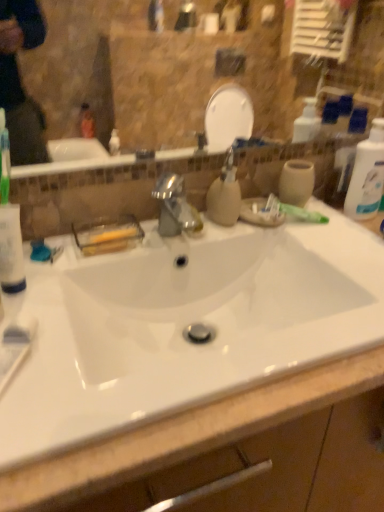
Find the location of a particular element. This screenshot has width=384, height=512. green matte toothpaste at upper right is located at coordinates (291, 211).

Where is `green matte toothpaste at upper right`? green matte toothpaste at upper right is located at coordinates (291, 211).

Between green matte toothpaste at upper right and white plastic bottle at right, which one has larger size?

white plastic bottle at right.

Can you confirm if green matte toothpaste at upper right is shorter than white plastic bottle at right?

Indeed, green matte toothpaste at upper right has a lesser height compared to white plastic bottle at right.

Can you tell me how much green matte toothpaste at upper right and white plastic bottle at right differ in facing direction?

37.6 degrees.

Does green matte toothpaste at upper right come in front of white plastic bottle at right?

No, it is behind white plastic bottle at right.

Which object is thinner, white plastic bottle at right or matte beige soap dispenser at center?

Thinner between the two is white plastic bottle at right.

Is white plastic bottle at right taller or shorter than matte beige soap dispenser at center?

Considering their sizes, white plastic bottle at right has more height than matte beige soap dispenser at center.

Looking at this image, from a real-world perspective, is white plastic bottle at right located higher than matte beige soap dispenser at center?

Indeed, from a real-world perspective, white plastic bottle at right stands above matte beige soap dispenser at center.

From the image's perspective, does white plastic bottle at right appear lower than matte beige soap dispenser at center?

Incorrect, from the image's perspective, white plastic bottle at right is higher than matte beige soap dispenser at center.

From the picture: Are white plastic bottle at right and white glossy sink at center making contact?

There is a gap between white plastic bottle at right and white glossy sink at center.

Find the location of a particular element. sink that is below the white plastic bottle at right (from the image's perspective) is located at coordinates (183, 324).

Which point is more distant from viewer, (356,197) or (303,255)?

The point (356,197) is farther from the camera.

From the image's perspective, which one is positioned lower, white plastic bottle at right or white glossy sink at center?

white glossy sink at center, from the image's perspective.

From the image's perspective, relative to matte beige soap dispenser at center, is green matte toothpaste at upper right above or below?

From the image's perspective, green matte toothpaste at upper right appears below matte beige soap dispenser at center.

Is green matte toothpaste at upper right looking in the opposite direction of matte beige soap dispenser at center?

No, green matte toothpaste at upper right's orientation is not away from matte beige soap dispenser at center.

Is green matte toothpaste at upper right positioned beyond the bounds of matte beige soap dispenser at center?

That's correct, green matte toothpaste at upper right is outside of matte beige soap dispenser at center.

Is green matte toothpaste at upper right further to the viewer compared to matte beige soap dispenser at center?

Yes, it is.

Considering the sizes of objects green matte toothpaste at upper right and white glossy sink at center in the image provided, who is thinner, green matte toothpaste at upper right or white glossy sink at center?

With smaller width is green matte toothpaste at upper right.

Can you confirm if green matte toothpaste at upper right is taller than white glossy sink at center?

Incorrect, the height of green matte toothpaste at upper right is not larger of that of white glossy sink at center.

Is green matte toothpaste at upper right positioned with its back to white glossy sink at center?

No, green matte toothpaste at upper right is not facing the opposite direction of white glossy sink at center.

From the image's perspective, relative to white glossy sink at center, is green matte toothpaste at upper right above or below?

green matte toothpaste at upper right is situated higher than white glossy sink at center in the image.

Considering the sizes of objects matte beige soap dispenser at center and green matte toothpaste at upper right in the image provided, who is shorter, matte beige soap dispenser at center or green matte toothpaste at upper right?

With less height is green matte toothpaste at upper right.

From the image's perspective, is matte beige soap dispenser at center located above or below green matte toothpaste at upper right?

matte beige soap dispenser at center is situated higher than green matte toothpaste at upper right in the image.

Is matte beige soap dispenser at center oriented away from green matte toothpaste at upper right?

matte beige soap dispenser at center is not turned away from green matte toothpaste at upper right.

Can you tell me how much matte beige soap dispenser at center and white glossy sink at center differ in facing direction?

matte beige soap dispenser at center and white glossy sink at center are facing 0.138 degrees away from each other.

Looking at the image, does matte beige soap dispenser at center seem bigger or smaller compared to white glossy sink at center?

matte beige soap dispenser at center is smaller than white glossy sink at center.

Is matte beige soap dispenser at center oriented towards white glossy sink at center?

No, matte beige soap dispenser at center is not turned towards white glossy sink at center.

Image resolution: width=384 pixels, height=512 pixels. I want to click on cleaning product in front of the green matte toothpaste at upper right, so click(367, 175).

Locate an element on the screen. Image resolution: width=384 pixels, height=512 pixels. soap dispenser below the white plastic bottle at right (from a real-world perspective) is located at coordinates (225, 194).

Based on their spatial positions, is white plastic bottle at right or matte beige soap dispenser at center closer to green matte toothpaste at upper right?

The object closer to green matte toothpaste at upper right is matte beige soap dispenser at center.

Looking at this image, looking at the image, which one is located further to matte beige soap dispenser at center, white glossy sink at center or white plastic bottle at right?

Based on the image, white plastic bottle at right appears to be further to matte beige soap dispenser at center.

From the image, which object appears to be nearer to white glossy sink at center, matte beige soap dispenser at center or white plastic bottle at right?

matte beige soap dispenser at center lies closer to white glossy sink at center than the other object.

Considering their positions, is green matte toothpaste at upper right positioned further to white plastic bottle at right than matte beige soap dispenser at center?

Based on the image, matte beige soap dispenser at center appears to be further to white plastic bottle at right.

Considering their positions, is green matte toothpaste at upper right positioned closer to matte beige soap dispenser at center than white glossy sink at center?

Based on the image, green matte toothpaste at upper right appears to be nearer to matte beige soap dispenser at center.

Considering their positions, is green matte toothpaste at upper right positioned closer to white plastic bottle at right than white glossy sink at center?

green matte toothpaste at upper right is closer to white plastic bottle at right.

Looking at the image, which one is located closer to white glossy sink at center, green matte toothpaste at upper right or matte beige soap dispenser at center?

matte beige soap dispenser at center lies closer to white glossy sink at center than the other object.

Looking at the image, which one is located further to white glossy sink at center, matte beige soap dispenser at center or green matte toothpaste at upper right?

Based on the image, green matte toothpaste at upper right appears to be further to white glossy sink at center.

You are a GUI agent. You are given a task and a screenshot of the screen. Output one action in this format:
    pyautogui.click(x=<x>, y=<y>)
    Task: Click on the toothpaste that lies between white plastic bottle at right and white glossy sink at center from top to bottom
    
    Given the screenshot: What is the action you would take?
    pyautogui.click(x=291, y=211)

At what (x,y) coordinates should I click in order to perform the action: click on soap dispenser between white plastic bottle at right and white glossy sink at center vertically. Please return your answer as a coordinate pair (x, y). Looking at the image, I should click on (225, 194).

Identify the location of toothpaste situated between matte beige soap dispenser at center and white plastic bottle at right from left to right. The width and height of the screenshot is (384, 512). (291, 211).

Identify the location of toothpaste between matte beige soap dispenser at center and white glossy sink at center from top to bottom. The width and height of the screenshot is (384, 512). (291, 211).